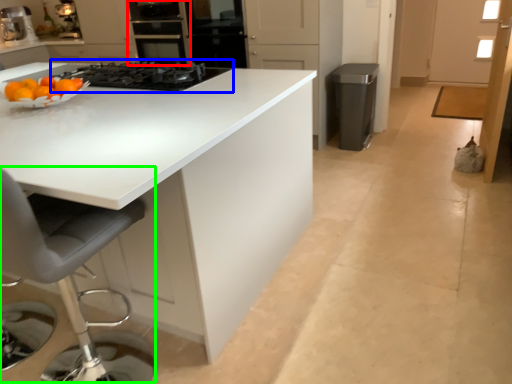
Question: Which object is the farthest from oven (highlighted by a red box)? Choose among these: gas stove (highlighted by a blue box) or swivel chair (highlighted by a green box).

Choices:
 (A) gas stove
 (B) swivel chair

Answer: (B)